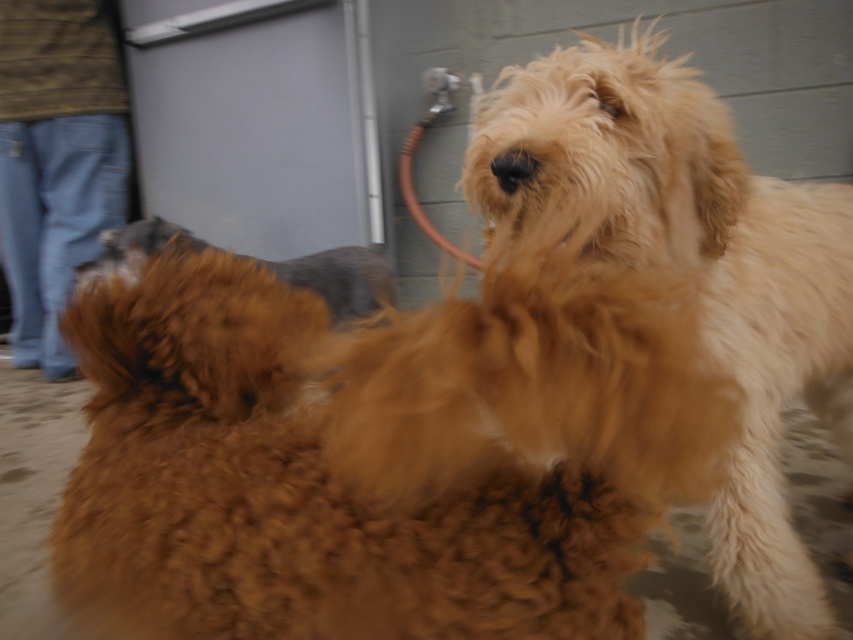
Question: Is fluffy golden dog at center thinner than brown fluffy dog at center?

Choices:
 (A) yes
 (B) no

Answer: (B)

Question: Which point is farther from the camera taking this photo?

Choices:
 (A) (326, 291)
 (B) (747, 353)

Answer: (A)

Question: Does fluffy golden dog at center come behind brown fluffy dog at center?

Choices:
 (A) yes
 (B) no

Answer: (B)

Question: Which object appears closest to the camera in this image?

Choices:
 (A) brown fluffy dog at center
 (B) fluffy golden dog at center

Answer: (B)

Question: Which object is closer to the camera taking this photo?

Choices:
 (A) brown fluffy dog at center
 (B) fluffy golden dog at center

Answer: (B)

Question: Does fluffy golden dog at center have a greater width compared to brown fluffy dog at center?

Choices:
 (A) no
 (B) yes

Answer: (B)